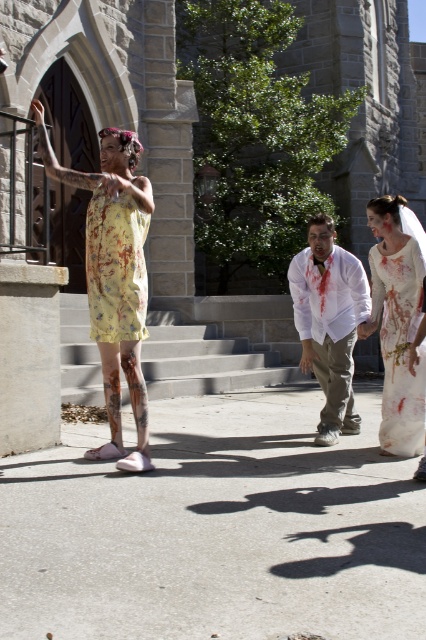
Question: Considering the relative positions of yellow printed dress at left and white matte shirt at center in the image provided, where is yellow printed dress at left located with respect to white matte shirt at center?

Choices:
 (A) right
 (B) left

Answer: (B)

Question: Does gray concrete stairs at center appear over white matte shirt at center?

Choices:
 (A) no
 (B) yes

Answer: (A)

Question: Which is nearer to the white matte shirt at center?

Choices:
 (A) yellow printed dress at left
 (B) gray concrete stairs at center
 (C) white satin dress at center

Answer: (C)

Question: Can you confirm if white satin dress at center is bigger than white matte shirt at center?

Choices:
 (A) yes
 (B) no

Answer: (B)

Question: Which object appears closest to the camera in this image?

Choices:
 (A) white matte shirt at center
 (B) white satin dress at center

Answer: (B)

Question: Which point appears farthest from the camera in this image?

Choices:
 (A) (88, 253)
 (B) (336, 252)

Answer: (B)